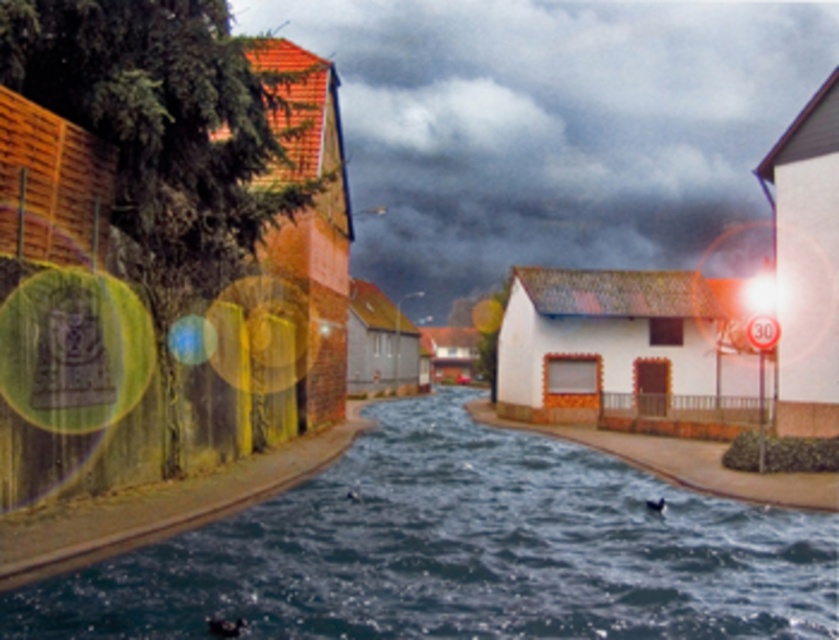
Looking at the flooded street scene, which object is positioned to the right when comparing the dark cloudy sky at upper center and the dark blue liquid at center?

The dark cloudy sky at upper center is to the right of the dark blue liquid at center according to the description.

In the scene shown: You are a weather balloon operator observing the flooded street scene. You notice the dark cloudy sky at upper center and the dark blue liquid at center. Which object in the scene occupies a larger area?

The dark cloudy sky at upper center is bigger than the dark blue liquid at center, so the dark cloudy sky at upper center occupies a larger area.

You are a delivery drone flying above the flooded street scene. You need to deliver a package to a location marked by point (498, 228) and then proceed to another location marked by point (353, 513). Given the flooded conditions, which point should you visit first to ensure the shortest path without backtracking?

You should visit point (353, 513) first because point (498, 228) is behind it. This way, you can fly forward to the first point and then proceed onward to the second without needing to backtrack over flooded areas.